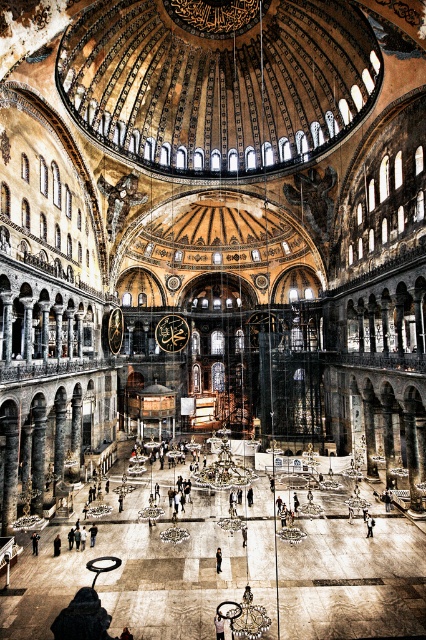
Question: Which is nearer to the dark gray fabric jacket at center?

Choices:
 (A) black leather jacket at center
 (B) dark blue jeans at center

Answer: (B)

Question: Does dark blue jeans at center have a larger size compared to dark gray fabric jacket at center?

Choices:
 (A) no
 (B) yes

Answer: (B)

Question: Which of the following is the farthest from the observer?

Choices:
 (A) (368, 532)
 (B) (36, 552)

Answer: (A)

Question: Where is black leather jacket at center located in relation to dark gray fabric jacket at center in the image?

Choices:
 (A) left
 (B) right

Answer: (A)

Question: Does black leather jacket at center have a greater width compared to dark blue jeans at center?

Choices:
 (A) no
 (B) yes

Answer: (B)

Question: Among these objects, which one is farthest from the camera?

Choices:
 (A) dark gray fabric jacket at center
 (B) black leather jacket at center

Answer: (B)